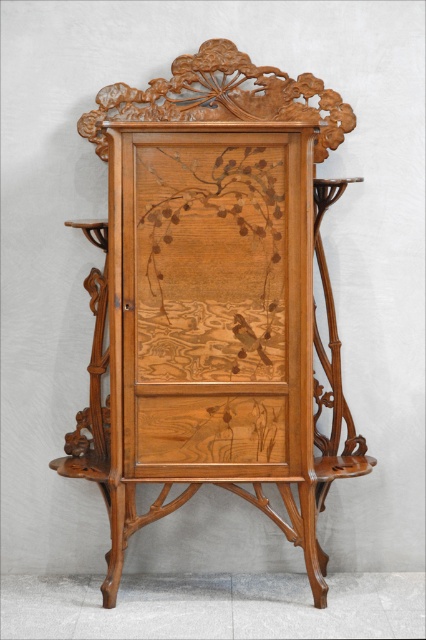
Is natural wood cabinet at center above natural wood drawer at center?

Correct, natural wood cabinet at center is located above natural wood drawer at center.

How far apart are natural wood cabinet at center and natural wood drawer at center?

25.73 centimeters

Where is `natural wood cabinet at center`? natural wood cabinet at center is located at coordinates (213, 298).